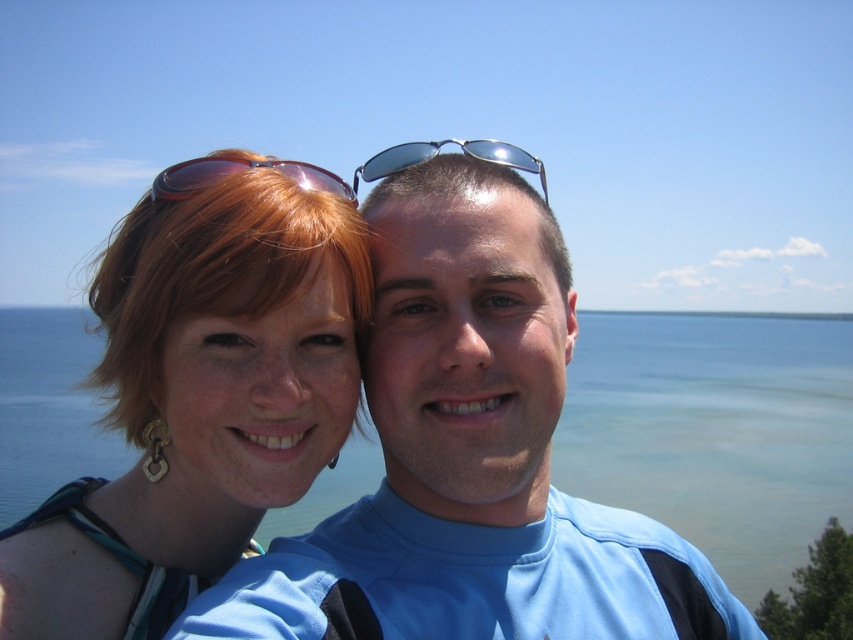
Question: Can you confirm if blue water at center is thinner than matte red sunglasses at upper left?

Choices:
 (A) yes
 (B) no

Answer: (B)

Question: Can you confirm if matte gold hoop earrings at center is positioned to the right of metallic reflective sunglasses at center?

Choices:
 (A) yes
 (B) no

Answer: (B)

Question: Which object is the farthest from the blue water at center?

Choices:
 (A) matte gold hoop earrings at center
 (B) matte red sunglasses at upper left
 (C) metallic reflective sunglasses at center

Answer: (B)

Question: Estimate the real-world distances between objects in this image. Which object is farther from the matte red sunglasses at upper left?

Choices:
 (A) blue water at center
 (B) matte gold hoop earrings at center
 (C) metallic reflective sunglasses at center

Answer: (A)

Question: Is blue water at center thinner than matte red sunglasses at upper left?

Choices:
 (A) no
 (B) yes

Answer: (A)

Question: Which point is farther from the camera taking this photo?

Choices:
 (A) (24, 349)
 (B) (184, 192)
 (C) (262, 378)

Answer: (A)